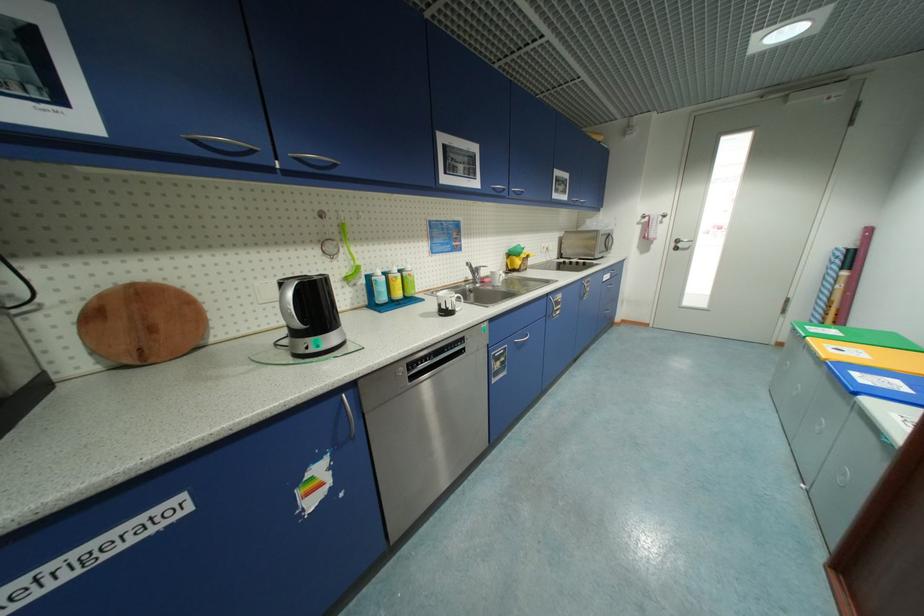
Find the location of a particular element. This screenshot has width=924, height=616. silver door handle is located at coordinates (681, 244).